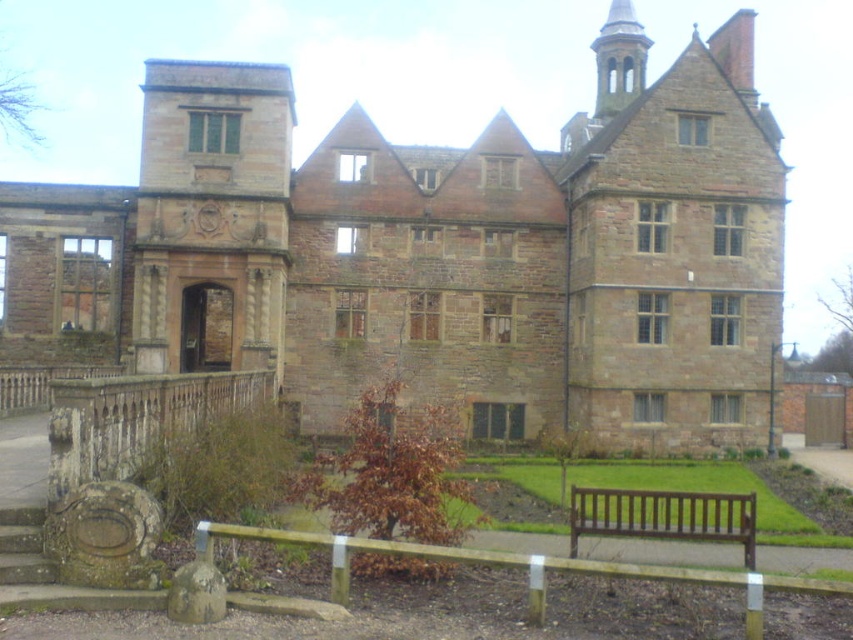
Question: Which point is farther to the camera?

Choices:
 (A) brown stone mansion at center
 (B) brown wooden bench at lower center

Answer: (A)

Question: Does brown stone mansion at center appear on the right side of brown wooden bench at lower center?

Choices:
 (A) yes
 (B) no

Answer: (B)

Question: Does brown stone mansion at center appear on the right side of brown wooden bench at lower center?

Choices:
 (A) no
 (B) yes

Answer: (A)

Question: Among these points, which one is farthest from the camera?

Choices:
 (A) 627,202
 (B) 705,509

Answer: (A)

Question: Is the position of brown stone mansion at center more distant than that of brown wooden bench at lower center?

Choices:
 (A) yes
 (B) no

Answer: (A)